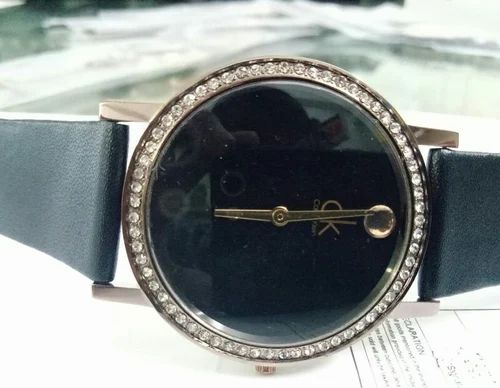
Image resolution: width=500 pixels, height=388 pixels. I want to click on gold screw, so click(x=280, y=219).